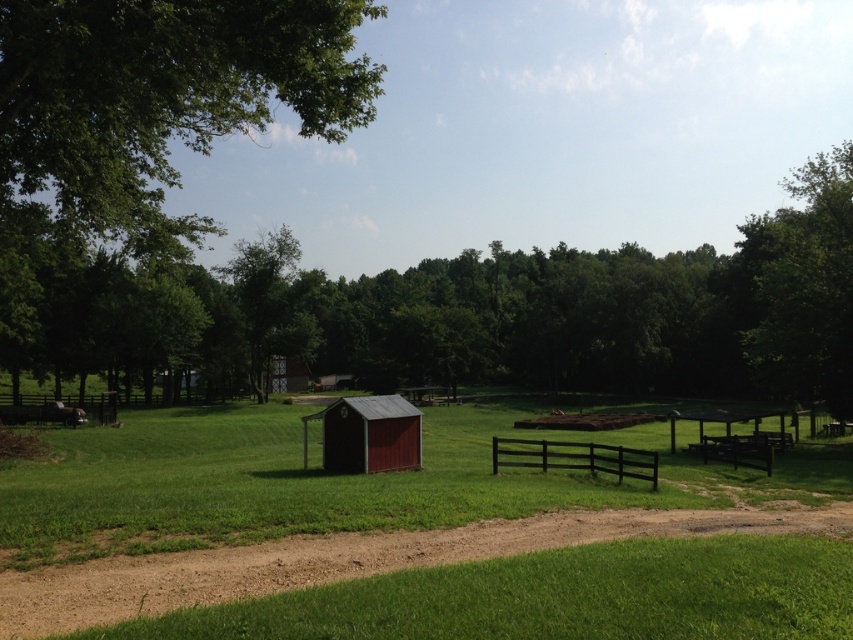
Question: Is dirt track at lower center to the left of green leafy tree at upper right from the viewer's perspective?

Choices:
 (A) yes
 (B) no

Answer: (A)

Question: Which object is the closest to the black wooden fence at center?

Choices:
 (A) dirt track at lower center
 (B) matte red shed at center
 (C) green leafy tree at upper left
 (D) green leafy tree at upper right

Answer: (B)

Question: Is green leafy tree at center below green leafy tree at upper right?

Choices:
 (A) no
 (B) yes

Answer: (B)

Question: Is dirt track at lower center below green leafy tree at upper right?

Choices:
 (A) no
 (B) yes

Answer: (B)

Question: Which object is the farthest from the green leafy tree at upper right?

Choices:
 (A) green leafy tree at center
 (B) dirt track at lower center
 (C) matte red shed at center

Answer: (C)

Question: Which of the following is the closest to the observer?

Choices:
 (A) green leafy tree at upper right
 (B) green leafy tree at center
 (C) black wooden fence at center
 (D) green leafy tree at upper left

Answer: (D)